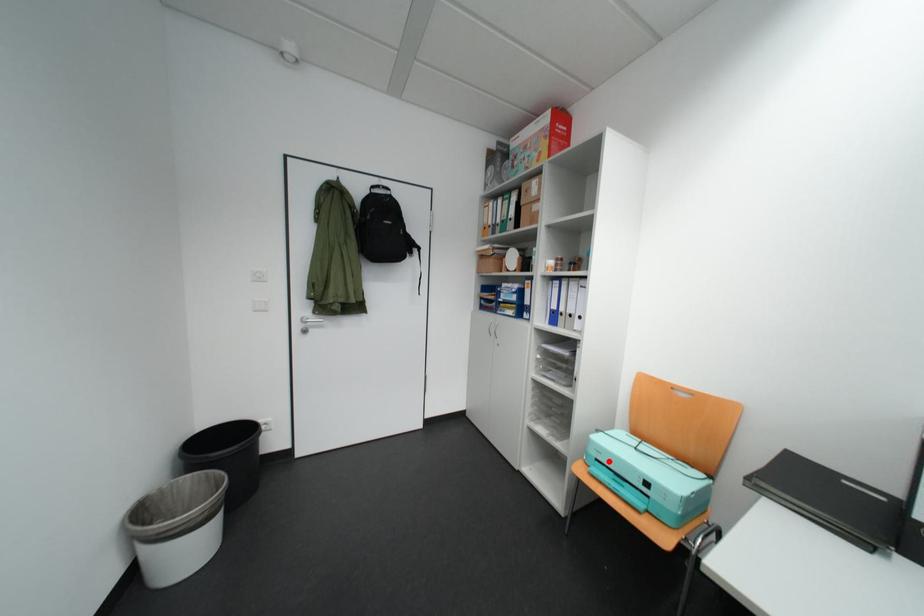
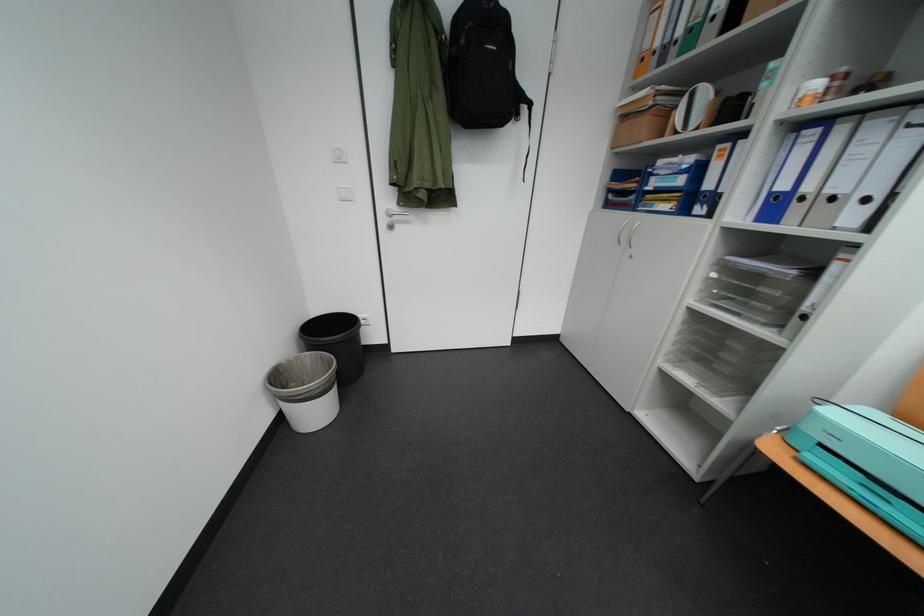
In the second image, find the point that corresponds to the highlighted location in the first image.

(833, 447)